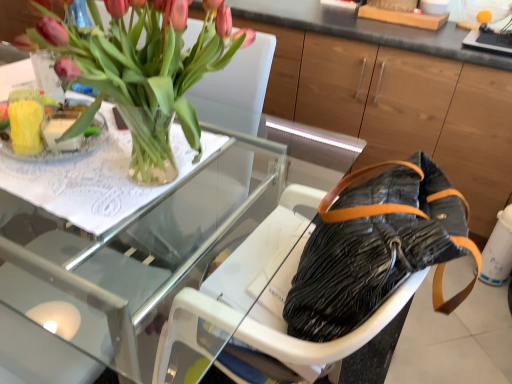
Find the location of a particular element. black fabric armchair at center is located at coordinates (264, 299).

What is the approximate width of transparent glass table at upper left?

transparent glass table at upper left is 35.69 inches wide.

This screenshot has height=384, width=512. I want to click on transparent glass table at upper left, so click(x=128, y=238).

Locate an element on the screen. black fabric armchair at center is located at coordinates (264, 299).

Can you confirm if pink matte tulips at upper left is bigger than transparent glass table at upper left?

No.

Is pink matte tulips at upper left positioned behind transparent glass table at upper left?

No, pink matte tulips at upper left is in front of transparent glass table at upper left.

From a real-world perspective, between pink matte tulips at upper left and transparent glass table at upper left, who is vertically lower?

In real-world perspective, transparent glass table at upper left is lower.

You are a GUI agent. You are given a task and a screenshot of the screen. Output one action in this format:
    pyautogui.click(x=<x>, y=<y>)
    Task: Click on the table located below the pink matte tulips at upper left (from the image's perspective)
    
    Given the screenshot: What is the action you would take?
    pyautogui.click(x=128, y=238)

Who is smaller, leather handbag at center or pink matte tulips at upper left?

leather handbag at center.

Is leather handbag at center in front of pink matte tulips at upper left?

No, leather handbag at center is behind pink matte tulips at upper left.

From a real-world perspective, does leather handbag at center sit lower than pink matte tulips at upper left?

Yes, from a real-world perspective, leather handbag at center is under pink matte tulips at upper left.

Is point (445, 254) closer to camera compared to point (156, 172)?

Yes, point (445, 254) is in front of point (156, 172).

Measure the distance between black fabric armchair at center and leather handbag at center.

black fabric armchair at center is 5.43 inches away from leather handbag at center.

Is black fabric armchair at center far from leather handbag at center?

black fabric armchair at center is actually quite close to leather handbag at center.

Which of these two, black fabric armchair at center or leather handbag at center, stands shorter?

Standing shorter between the two is black fabric armchair at center.

Locate an element on the screen. The width and height of the screenshot is (512, 384). armchair below the leather handbag at center (from a real-world perspective) is located at coordinates (264, 299).

Which point is more distant from viewer, (314,355) or (152,80)?

The point (152,80) is farther.

Is black fabric armchair at center to the right of pink matte tulips at upper left from the viewer's perspective?

Yes, black fabric armchair at center is to the right of pink matte tulips at upper left.

Would you say black fabric armchair at center is a long distance from pink matte tulips at upper left?

That's not correct — black fabric armchair at center is a little close to pink matte tulips at upper left.

Where is `houseplant located above the black fabric armchair at center (from the image's perspective)`? houseplant located above the black fabric armchair at center (from the image's perspective) is located at coordinates (141, 70).

From a real-world perspective, is pink matte tulips at upper left above or below clear glass vase at upper left?

Clearly, from a real-world perspective, pink matte tulips at upper left is above clear glass vase at upper left.

This screenshot has width=512, height=384. I want to click on houseplant that appears above the clear glass vase at upper left (from a real-world perspective), so click(x=141, y=70).

Which of these two, pink matte tulips at upper left or clear glass vase at upper left, stands taller?

pink matte tulips at upper left.

From the image's perspective, would you say pink matte tulips at upper left is positioned over clear glass vase at upper left?

Incorrect, from the image's perspective, pink matte tulips at upper left is lower than clear glass vase at upper left.

From the image's perspective, which one is positioned lower, black fabric armchair at center or clear glass vase at upper left?

From the image's view, black fabric armchair at center is below.

Can you tell me how much black fabric armchair at center and clear glass vase at upper left differ in facing direction?

The angular difference between black fabric armchair at center and clear glass vase at upper left is 95.8 degrees.

Considering the relative sizes of black fabric armchair at center and clear glass vase at upper left in the image provided, is black fabric armchair at center thinner than clear glass vase at upper left?

No.

Does black fabric armchair at center have a lesser height compared to clear glass vase at upper left?

Incorrect, the height of black fabric armchair at center does not fall short of that of clear glass vase at upper left.

Measure the distance between black matte bag at lower right and leather handbag at center.

black matte bag at lower right and leather handbag at center are 3.59 feet apart.

From the image's perspective, is black matte bag at lower right beneath leather handbag at center?

No.

Which is correct: black matte bag at lower right is inside leather handbag at center, or outside of it?

black matte bag at lower right is spatially situated outside leather handbag at center.

Which point is more distant from viewer, (439, 152) or (378, 240)?

The point (439, 152) is farther.

Locate an element on the screen. This screenshot has height=384, width=512. table that appears behind the pink matte tulips at upper left is located at coordinates (128, 238).

Locate an element on the screen. This screenshot has height=384, width=512. handbag below the pink matte tulips at upper left (from the image's perspective) is located at coordinates [377, 247].

Based on their spatial positions, is black matte bag at lower right or black fabric armchair at center further from transparent glass table at upper left?

black matte bag at lower right is further to transparent glass table at upper left.

From the image, which object appears to be farther from clear glass vase at upper left, black fabric armchair at center or pink matte tulips at upper left?

black fabric armchair at center is positioned further to the anchor clear glass vase at upper left.

When comparing their distances from black fabric armchair at center, does clear glass vase at upper left or leather handbag at center seem closer?

leather handbag at center is positioned closer to the anchor black fabric armchair at center.

Estimate the real-world distances between objects in this image. Which object is closer to clear glass vase at upper left, black fabric armchair at center or transparent glass table at upper left?

transparent glass table at upper left is positioned closer to the anchor clear glass vase at upper left.

Estimate the real-world distances between objects in this image. Which object is further from black fabric armchair at center, leather handbag at center or clear glass vase at upper left?

clear glass vase at upper left.

From the image, which object appears to be nearer to transparent glass table at upper left, clear glass vase at upper left or pink matte tulips at upper left?

pink matte tulips at upper left.

Considering their positions, is pink matte tulips at upper left positioned closer to leather handbag at center than black matte bag at lower right?

pink matte tulips at upper left is positioned closer to the anchor leather handbag at center.

From the image, which object appears to be nearer to black fabric armchair at center, transparent glass table at upper left or black matte bag at lower right?

transparent glass table at upper left.

Identify the location of houseplant between clear glass vase at upper left and leather handbag at center in the horizontal direction. (141, 70).

Identify the location of glass vase between black matte bag at lower right and black fabric armchair at center in the vertical direction. (47, 74).

Locate an element on the screen. Image resolution: width=512 pixels, height=384 pixels. glass vase situated between black matte bag at lower right and leather handbag at center from left to right is located at coordinates (47, 74).

Where is `table between pink matte tulips at upper left and clear glass vase at upper left along the z-axis`? table between pink matte tulips at upper left and clear glass vase at upper left along the z-axis is located at coordinates (128, 238).